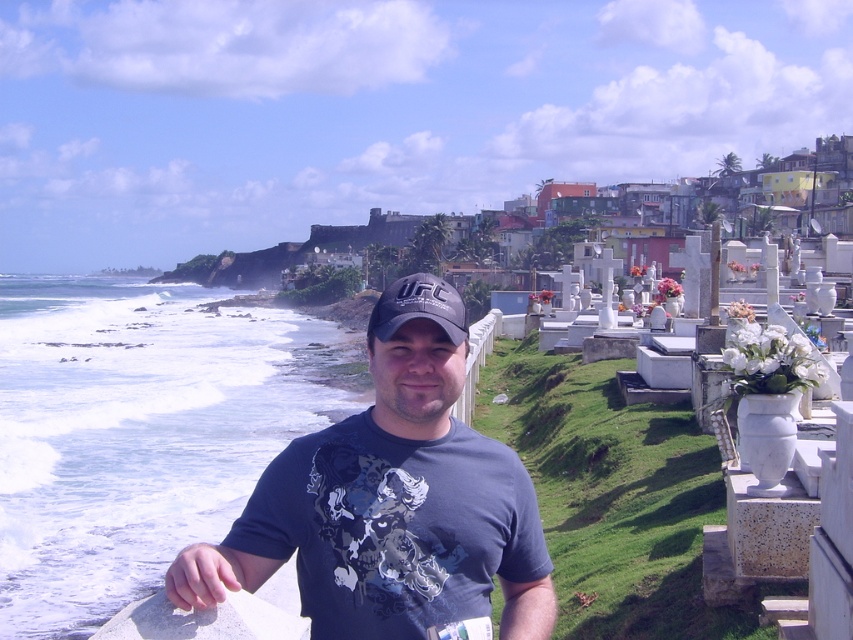
You are standing at the point closer to the viewer in the image. Which point are you at, point (x=442, y=566) or point (x=444, y=323)?

You are at point (x=442, y=566) because it is closer to the viewer than point (x=444, y=323).